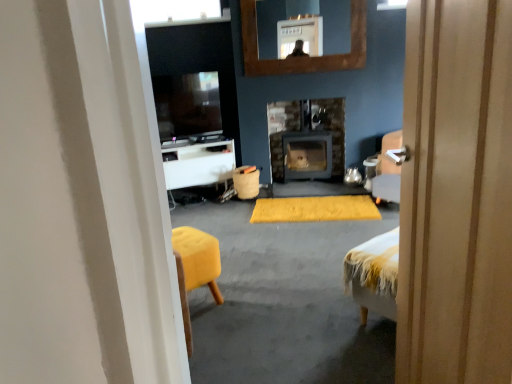
Find the location of a particular element. This screenshot has width=512, height=384. vacant region under wooden-framed mirror at upper center (from a real-world perspective) is located at coordinates (291, 188).